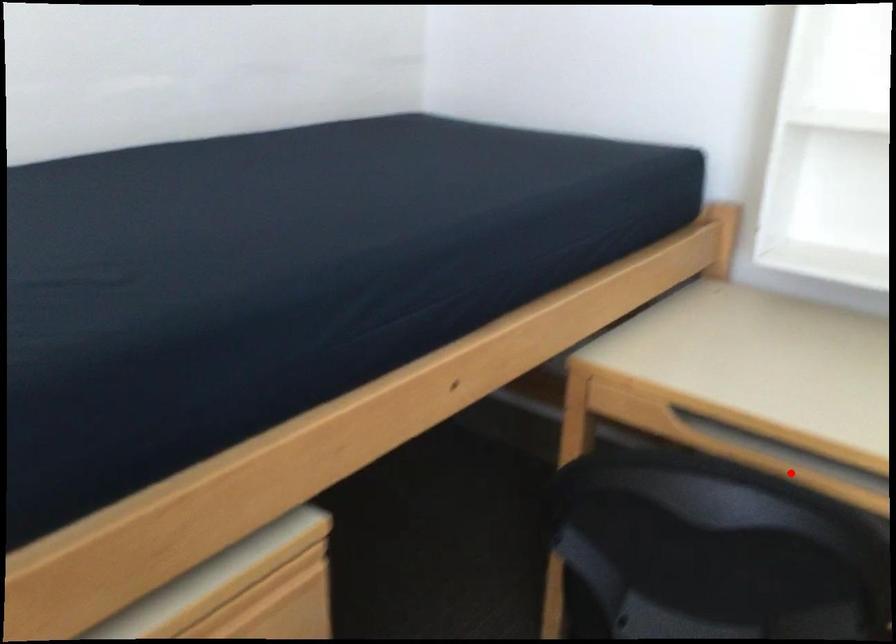
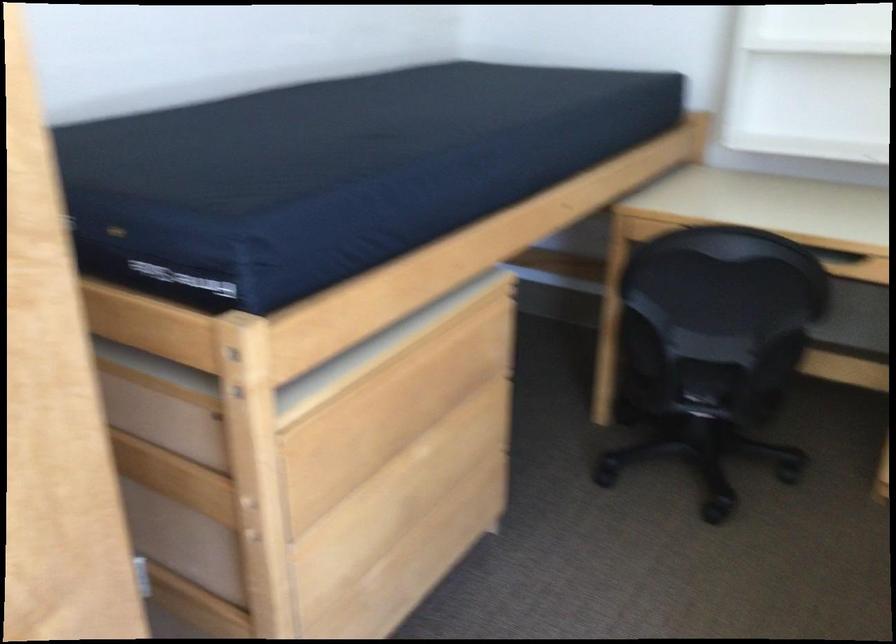
Question: I am providing you with two images of the same scene from different viewpoints. A red point is marked on the first image. Is the red point's position out of view in image 2?

Choices:
 (A) Yes
 (B) No

Answer: (A)